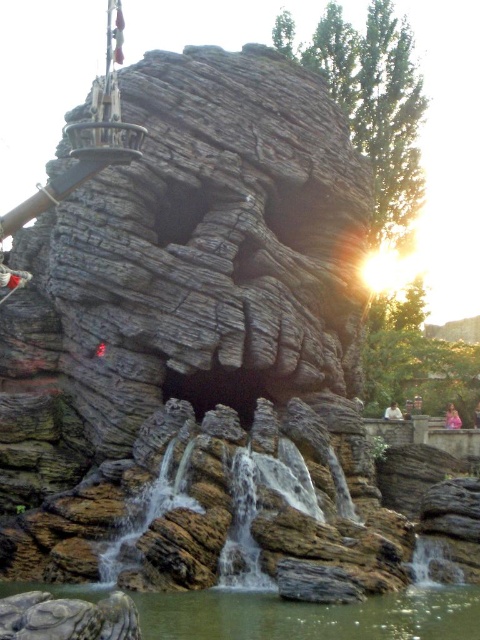
You are standing near the artificial rock formation and see the greenish water at lower center and the pink fabric person at lower right. Which object is taller?

The greenish water at lower center is much taller than the pink fabric person at lower right.

You are standing at the base of the artificial rock formation and see the greenish water at lower center and the light brown hair at center. Which object is closer to you?

The greenish water at lower center is 47.14 meters away from the light brown hair at center, so the light brown hair at center is closer to you.